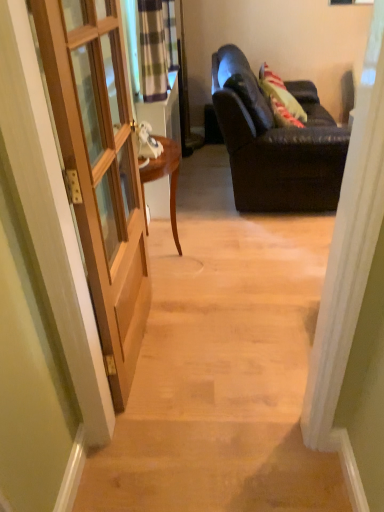
Locate an element on the screen. free space in front of wooden door at left is located at coordinates (162, 423).